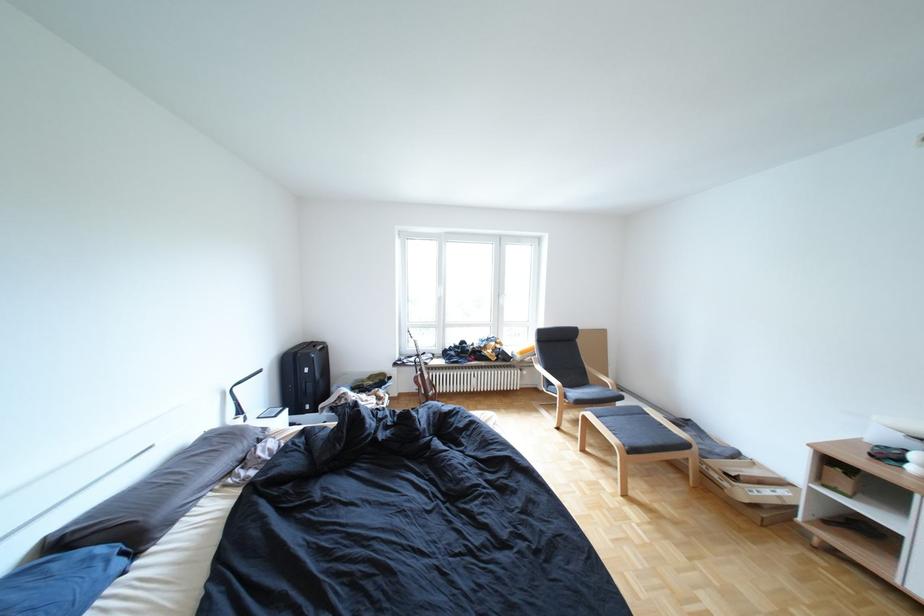
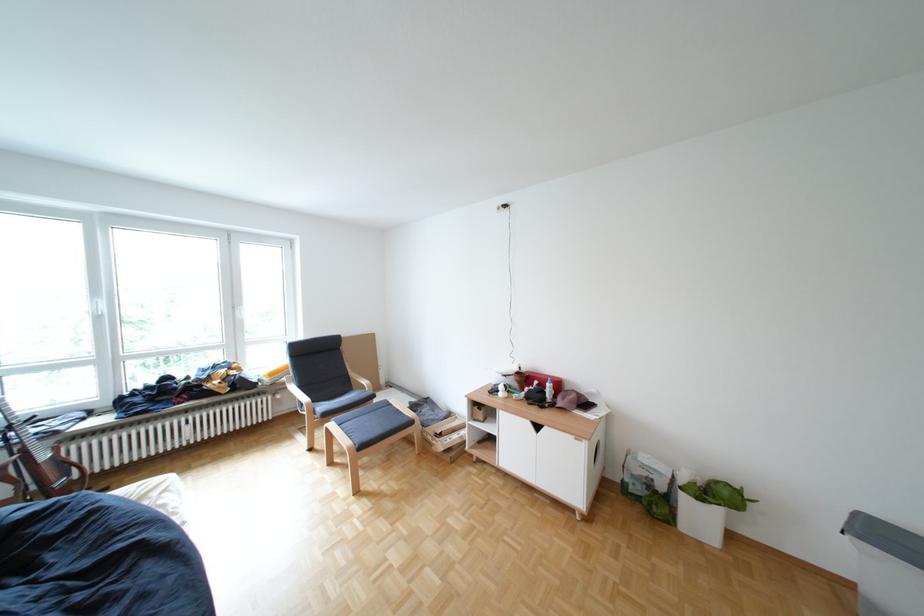
Where in the second image is the point corresponding to pixel 604 415 from the first image?

(346, 424)